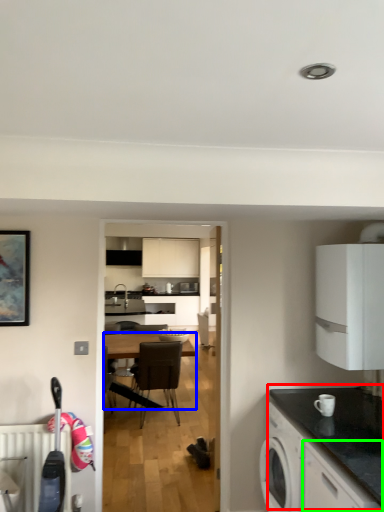
Question: Which object is positioned closest to countertop (highlighted by a red box)? Select from desk (highlighted by a blue box) and cabinetry (highlighted by a green box).

Choices:
 (A) desk
 (B) cabinetry

Answer: (B)